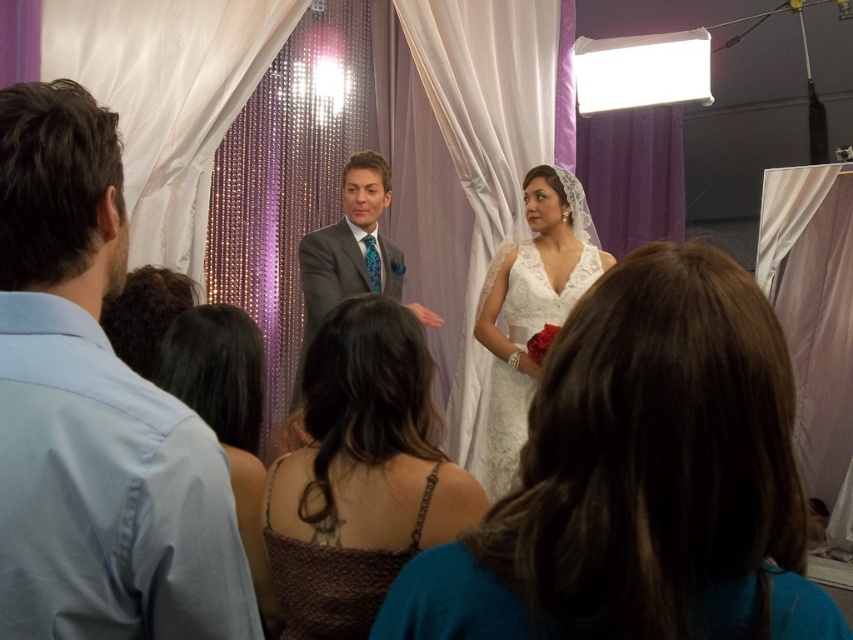
Question: Does light blue shirt at left have a lesser width compared to brown woven dress at center?

Choices:
 (A) no
 (B) yes

Answer: (B)

Question: Based on their relative distances, which object is farther from the brown textured dress at center?

Choices:
 (A) lace fabric dress at center
 (B) brown woven dress at center

Answer: (A)

Question: Does brown woven dress at center appear on the left side of lace fabric dress at center?

Choices:
 (A) no
 (B) yes

Answer: (B)

Question: Which point appears closest to the camera in this image?

Choices:
 (A) (306, 243)
 (B) (112, 288)

Answer: (B)

Question: Is white lace dress at center thinner than brown woven dress at center?

Choices:
 (A) no
 (B) yes

Answer: (A)

Question: Which object is positioned farthest from the white lace dress at center?

Choices:
 (A) gray suit at center
 (B) brown woven dress at center
 (C) brown textured dress at center

Answer: (A)